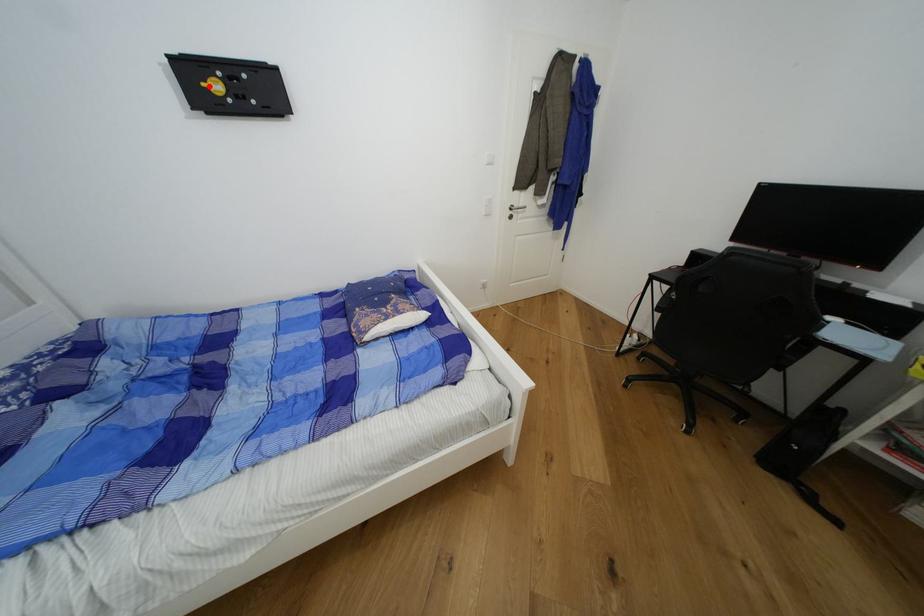
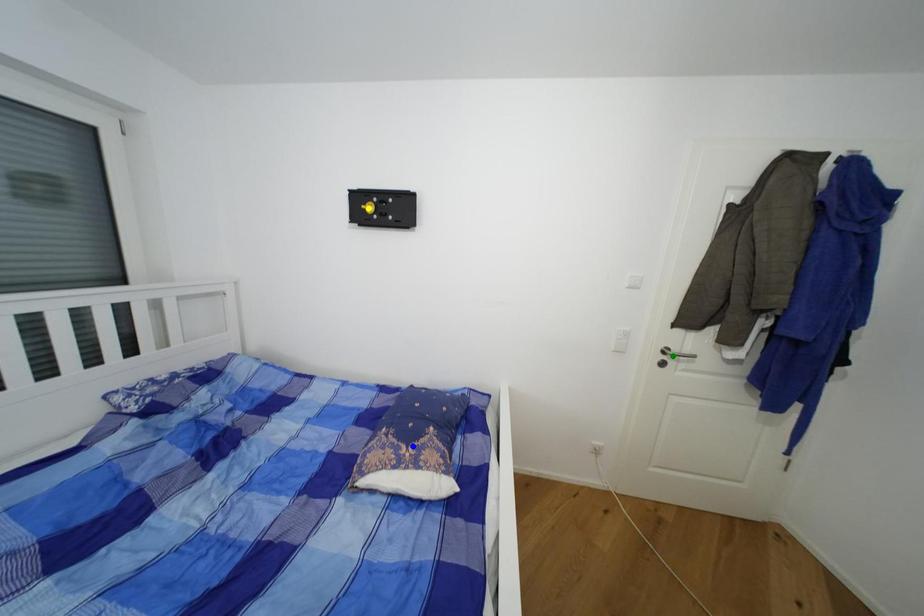
Question: I am providing you with two images of the same scene from different viewpoints. A red point is marked on the first image. You are given multiple points on the second image. In image 2, which mark is for the same physical point as the one in image 1?

Choices:
 (A) green point
 (B) blue point
 (C) yellow point

Answer: (C)